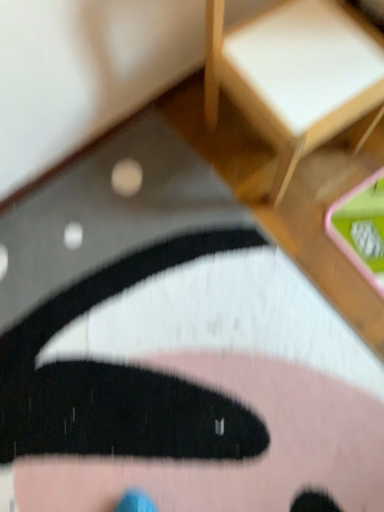
You are a GUI agent. You are given a task and a screenshot of the screen. Output one action in this format:
    pyautogui.click(x=<x>, y=<y>)
    Task: Click on the wooden stool at upper right
    The image size is (384, 512).
    Given the screenshot: What is the action you would take?
    pyautogui.click(x=294, y=75)

What do you see at coordinates (294, 75) in the screenshot? This screenshot has height=512, width=384. I see `wooden stool at upper right` at bounding box center [294, 75].

The height and width of the screenshot is (512, 384). I want to click on wooden stool at upper right, so click(x=294, y=75).